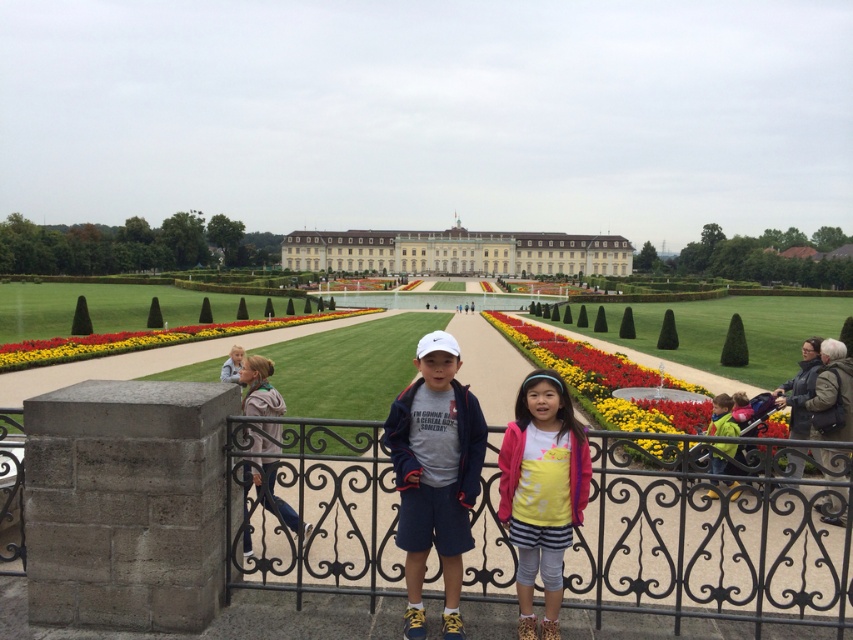
Question: Estimate the real-world distances between objects in this image. Which object is closer to the light pink fabric jacket at lower right?

Choices:
 (A) floral carpet at center
 (B) iron wrought fence at center
 (C) light pink fabric jacket at center

Answer: (B)

Question: Is white stone palace at center thinner than light pink fabric jacket at center?

Choices:
 (A) yes
 (B) no

Answer: (B)

Question: Can you confirm if white stone palace at center is positioned above yellow fabric flower at center?

Choices:
 (A) no
 (B) yes

Answer: (B)

Question: Which object is closer to the camera taking this photo?

Choices:
 (A) iron wrought fence at center
 (B) yellow fabric flower at center

Answer: (A)

Question: In this image, where is matte blue shorts at center located relative to yellow fabric flower at center?

Choices:
 (A) above
 (B) below

Answer: (B)

Question: Which point is closer to the camera taking this photo?

Choices:
 (A) click(428, 269)
 (B) click(518, 566)
 (C) click(550, 344)
 (D) click(305, 524)

Answer: (B)